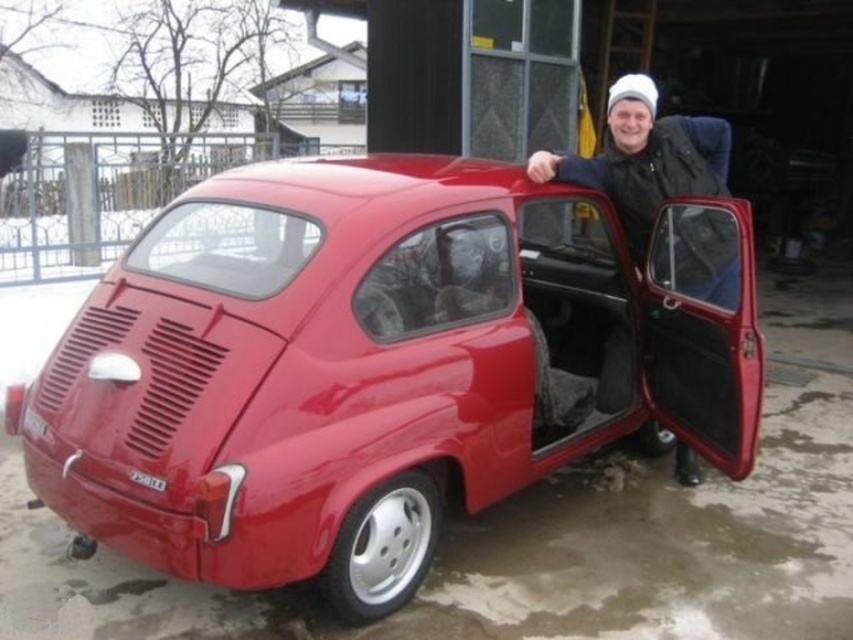
Question: Is glossy red car door at right thinner than white knit cap at upper center?

Choices:
 (A) yes
 (B) no

Answer: (B)

Question: Considering the real-world distances, which object is closest to the glossy red car door at right?

Choices:
 (A) glossy red car at center
 (B) white knit cap at upper center

Answer: (A)

Question: Can you confirm if glossy red car at center is positioned below white knit cap at upper center?

Choices:
 (A) no
 (B) yes

Answer: (B)

Question: Does glossy red car at center appear under white knit cap at upper center?

Choices:
 (A) yes
 (B) no

Answer: (A)

Question: Which point is farther to the camera?

Choices:
 (A) pyautogui.click(x=555, y=307)
 (B) pyautogui.click(x=548, y=166)
 (C) pyautogui.click(x=729, y=330)

Answer: (A)

Question: Among these points, which one is nearest to the camera?

Choices:
 (A) (721, 390)
 (B) (610, 205)

Answer: (A)